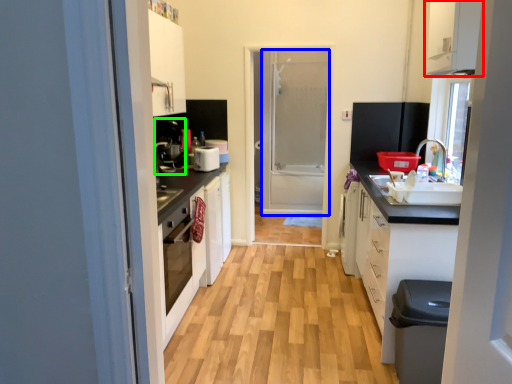
Question: Considering the real-world distances, which object is closest to cabinetry (highlighted by a red box)? screen door (highlighted by a blue box) or coffee machine (highlighted by a green box).

Choices:
 (A) screen door
 (B) coffee machine

Answer: (B)